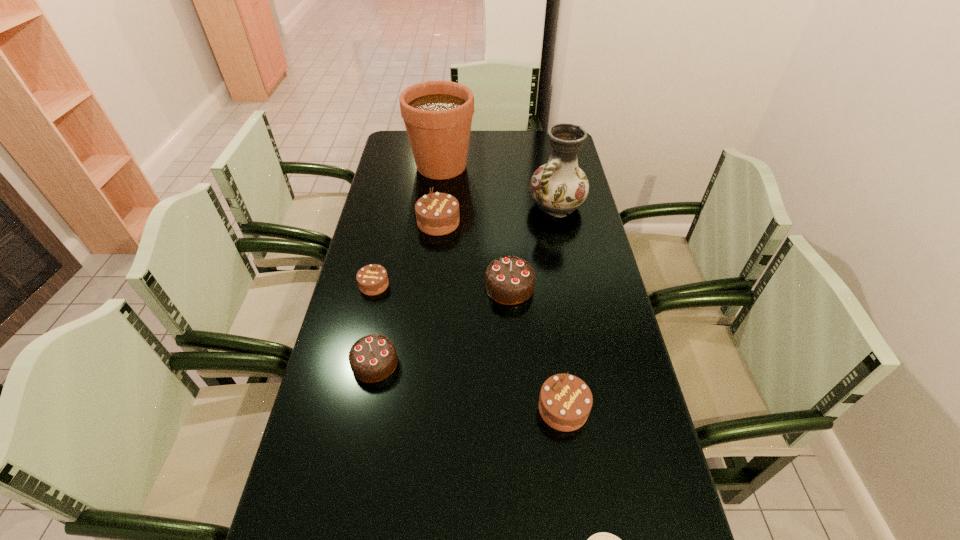
You are a GUI agent. You are given a task and a screenshot of the screen. Output one action in this format:
    pyautogui.click(x=<x>, y=<y>)
    Task: Click on the flowerpot that is at the left edge
    Image resolution: width=960 pixels, height=540 pixels.
    Given the screenshot: What is the action you would take?
    pyautogui.click(x=438, y=115)

I want to click on vase positioned at the right edge, so click(x=558, y=187).

Find the location of `chocolate cake that is at the right edge`. chocolate cake that is at the right edge is located at coordinates (565, 401).

Where is `object at the far left corner`? object at the far left corner is located at coordinates (438, 115).

The image size is (960, 540). I want to click on vacant position at the left edge of the desktop, so click(x=369, y=247).

In order to click on vacant space at the right edge in this screenshot , I will do `click(613, 399)`.

The height and width of the screenshot is (540, 960). Find the location of `vacant point located between the nearest chocolate cake and the nearer chocolate chocolate cake`. vacant point located between the nearest chocolate cake and the nearer chocolate chocolate cake is located at coordinates (469, 386).

The image size is (960, 540). In order to click on vacant area between the second shortest object and the farthest object in this screenshot , I will do 408,225.

You are a GUI agent. You are given a task and a screenshot of the screen. Output one action in this format:
    pyautogui.click(x=<x>, y=<y>)
    Task: Click on the free space between the biggest brown chocolate cake and the smaller chocolate chocolate cake
    The height and width of the screenshot is (540, 960).
    Given the screenshot: What is the action you would take?
    pyautogui.click(x=407, y=293)

This screenshot has width=960, height=540. I want to click on vacant area between the bigger chocolate chocolate cake and the sixth farthest object, so click(443, 325).